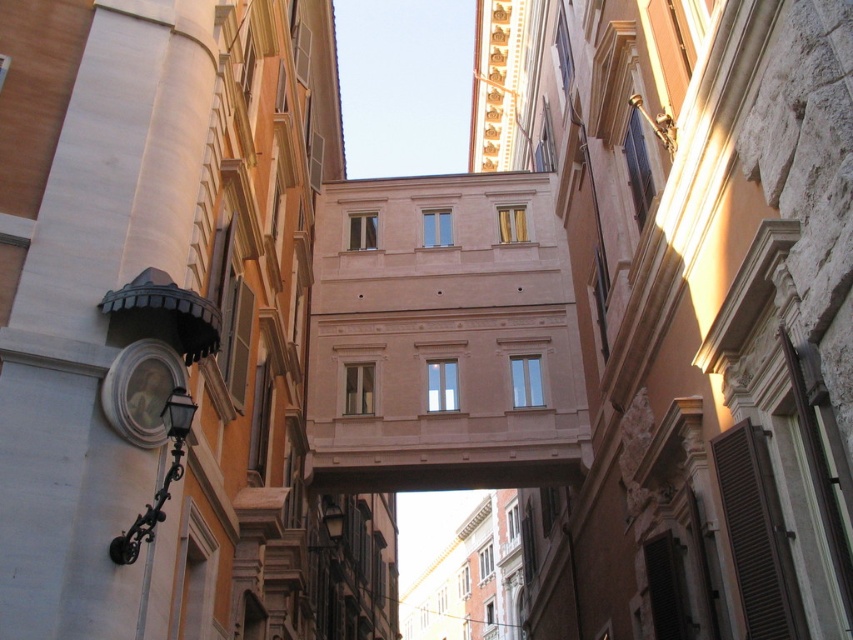
Consider the image. You are a window installer who needs to place a new window on the smooth stone wall at center and the smooth beige building at center. Which surface has enough height to accommodate a large window that requires 10 feet of vertical space?

The smooth stone wall at center is much taller than the smooth beige building at center, so it has enough vertical space to accommodate the large window requiring 10 feet of height.

You are a painter who wants to paint both the smooth stone wall at center and the smooth beige building at center. Which one do you think will require less paint due to its size?

The smooth stone wall at center is thinner than the smooth beige building at center, so it will require less paint.

You are a painter standing in the narrow alleyway and want to paint both the smooth stone wall at center and the smooth beige building at center. Which object should you focus on first if you want to paint the smaller one before the larger one?

The smooth stone wall at center is smaller than the smooth beige building at center, so you should focus on painting the smooth stone wall at center first.